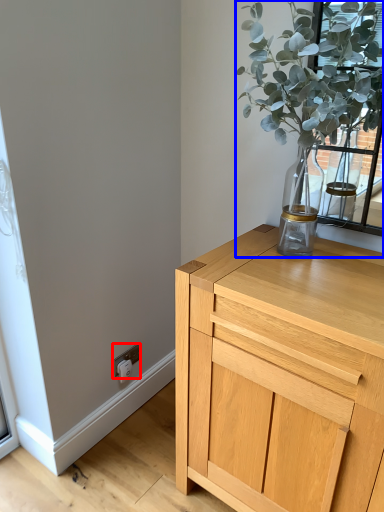
Question: Which of the following is the farthest to the observer, electric outlet (highlighted by a red box) or houseplant (highlighted by a blue box)?

Choices:
 (A) electric outlet
 (B) houseplant

Answer: (A)